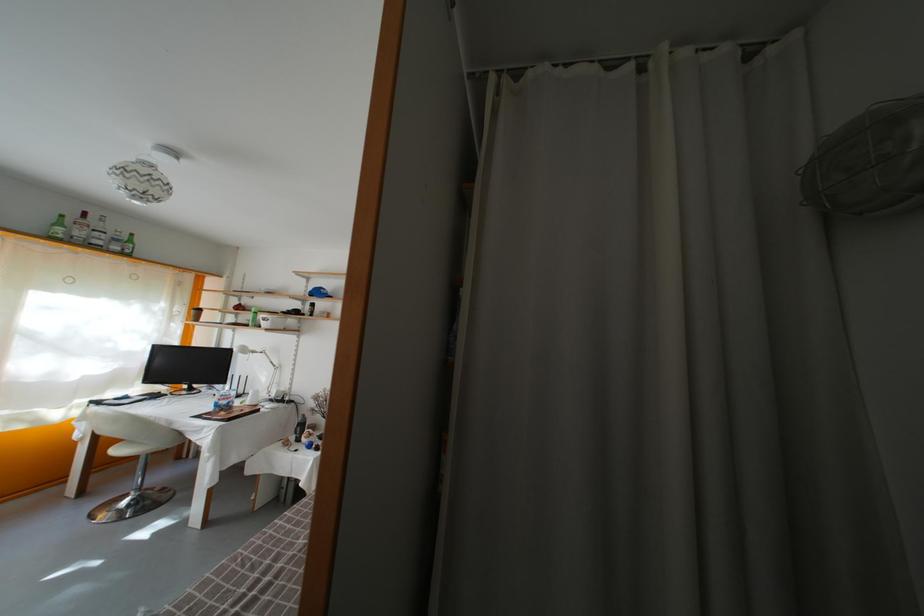
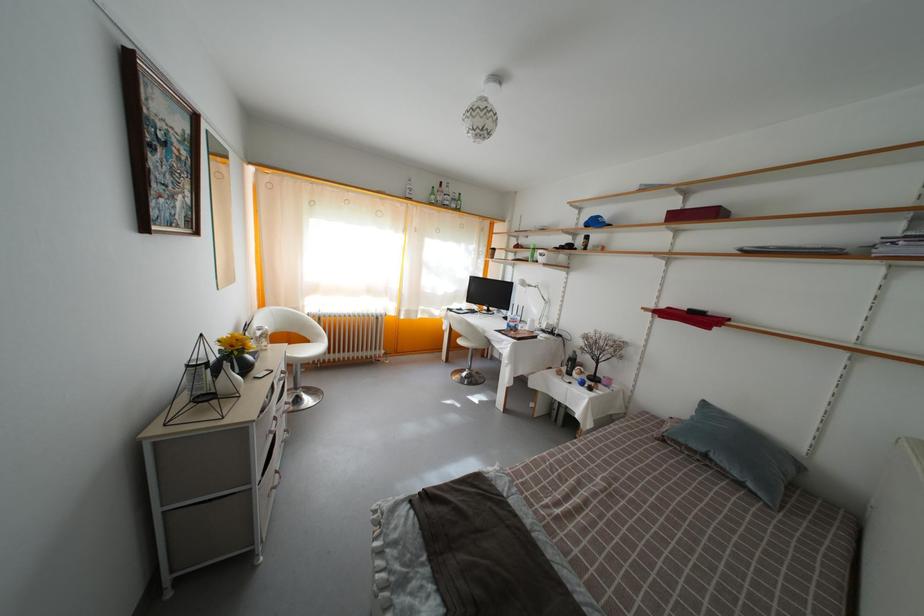
Where in the second image is the point corresponding to point (299, 444) from the first image?

(569, 376)